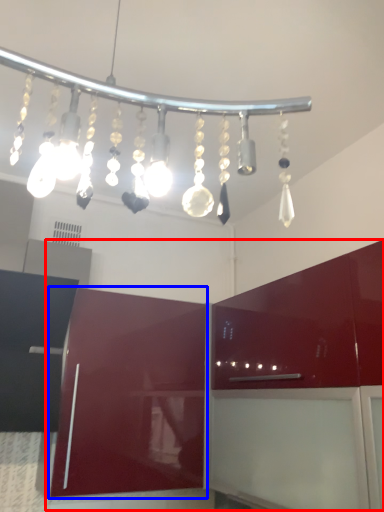
Question: Among these objects, which one is nearest to the camera, cabinetry (highlighted by a red box) or cabinetry (highlighted by a blue box)?

Choices:
 (A) cabinetry
 (B) cabinetry

Answer: (A)